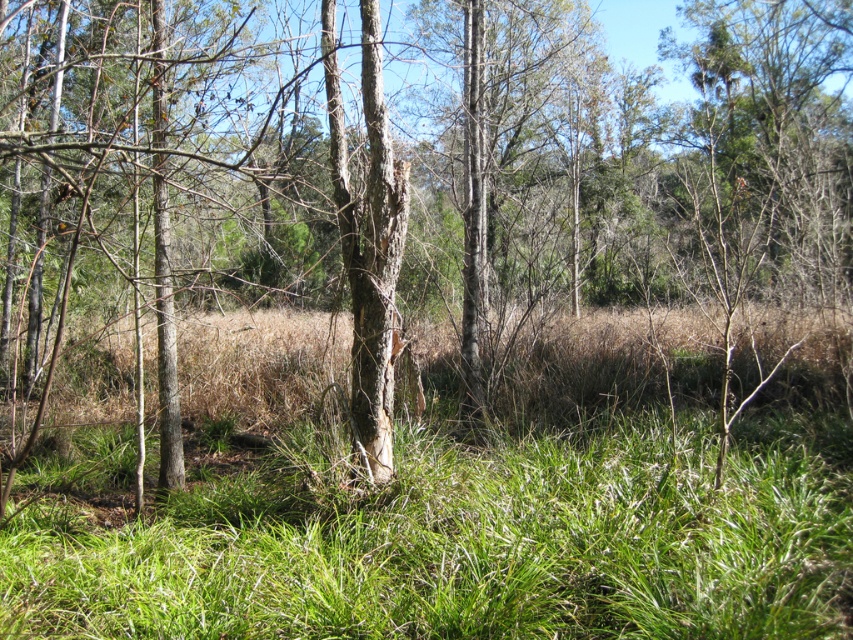
You are standing in the wooded area and want to walk from the smooth bark tree trunk at center to the green grass at center. In which direction should you move?

You should move to the right to reach the green grass at center from the smooth bark tree trunk at center, as the green grass at center is located to the right of the smooth bark tree trunk at center according to the description.

You are a hiker trying to determine the best path through the woods. You notice green grass at center and smooth bark tree trunk at center. Which of these two features is taller?

The smooth bark tree trunk at center is taller than the green grass at center.